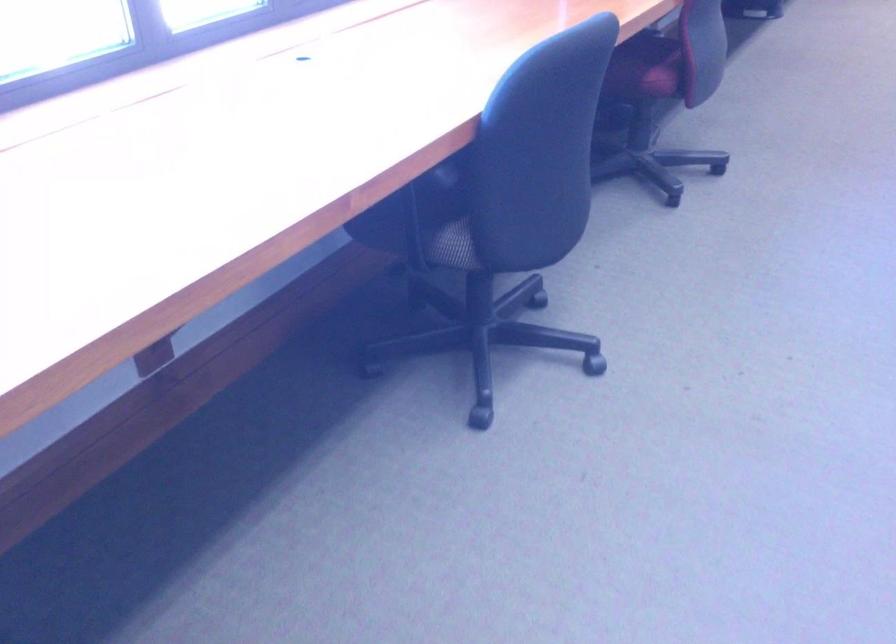
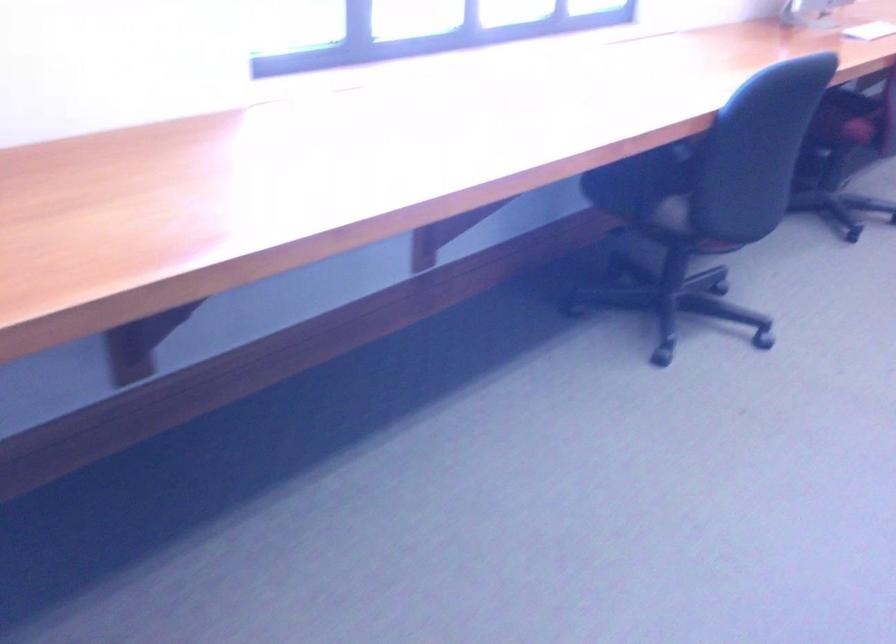
Question: The first image is from the beginning of the video and the second image is from the end. How did the camera likely rotate when shooting the video?

Choices:
 (A) Left
 (B) Right
 (C) Up
 (D) Down

Answer: (A)